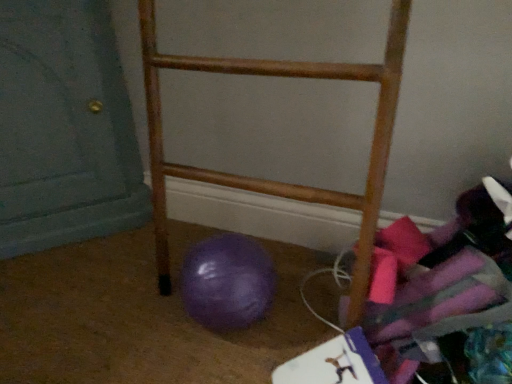
I want to click on empty space that is in between purple rubber ball at lower left and wooden rack at center, so click(274, 337).